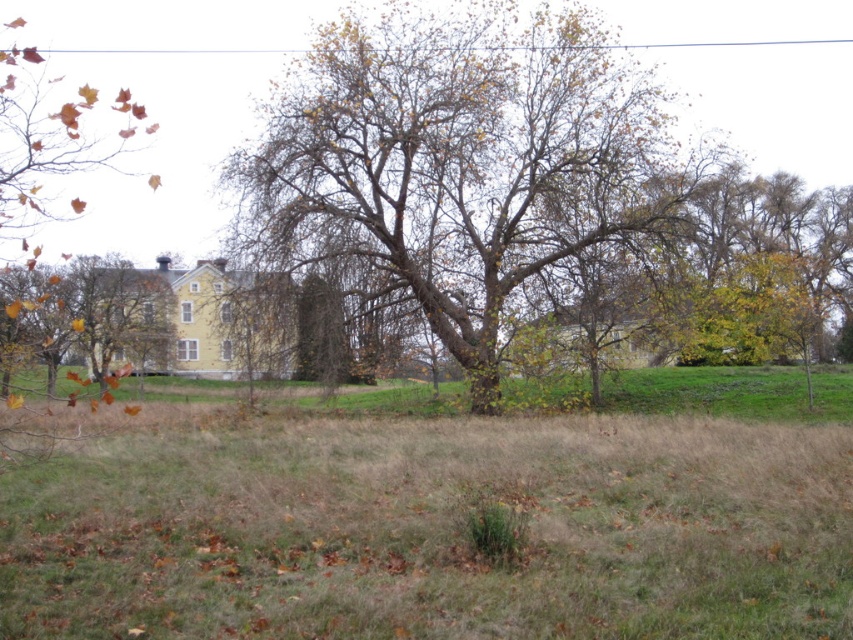
You are standing in the rural scene and want to place a small garden ornament between the brown grass at center and the brown rough bark tree at center. Based on their positions, where should you place it so it is between them?

The brown grass at center is located below the brown rough bark tree at center, so placing the garden ornament between them would mean positioning it in the space directly beneath the tree where the grass meets the tree trunk.

You are standing in the rural scene and want to walk towards the brown rough bark tree at center. As you move forward, will the brown grass at center become visible in front of the tree?

Yes, the brown grass at center is in front of the brown rough bark tree at center, so as you walk towards the tree, the grass will appear in front of it.

You are standing in the rural scene and want to walk from the brown grass at center to the brown rough bark tree at center. Which direction should you move to reach the tree?

You should move to the right to reach the brown rough bark tree at center because the brown grass at center is located to the left of the tree.